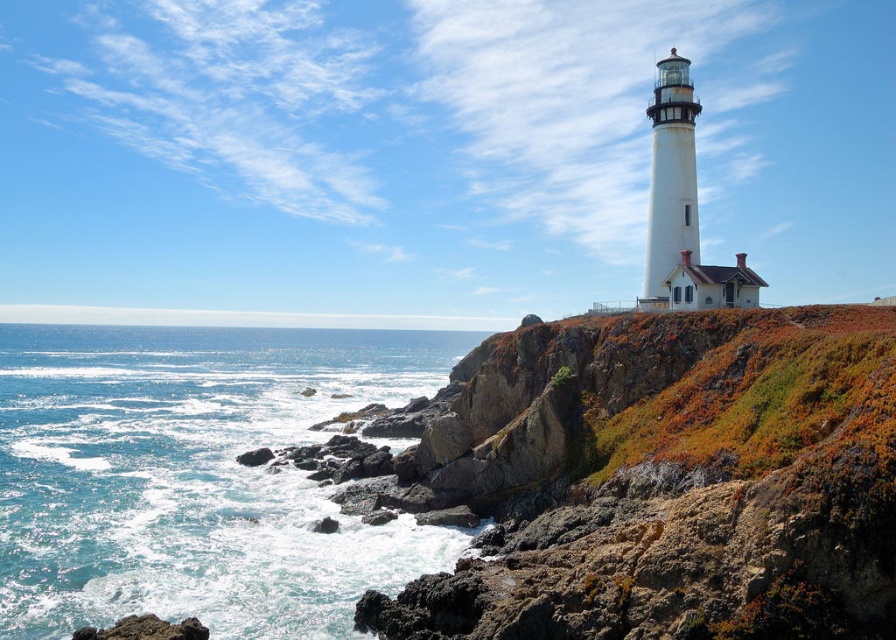
You are standing at the lighthouse and want to reach the blue water at lower left. According to the coordinates provided, which direction should you head towards?

The blue water at lower left is located at coordinates point (196, 476), so you should head towards the lower left direction to reach it.

You are standing at the base of the cliff and looking towards the lighthouse. There is blue water at lower left and rough textured rock at lower left in your view. Which one is taller from your perspective?

The blue water at lower left is taller than the rough textured rock at lower left from your perspective.

You are standing at the base of the cliff and see the blue water at lower left and the rough textured rock at lower left. Which object is closer to you?

The blue water at lower left is closer to you because it is further to the viewer than the rough textured rock at lower left.